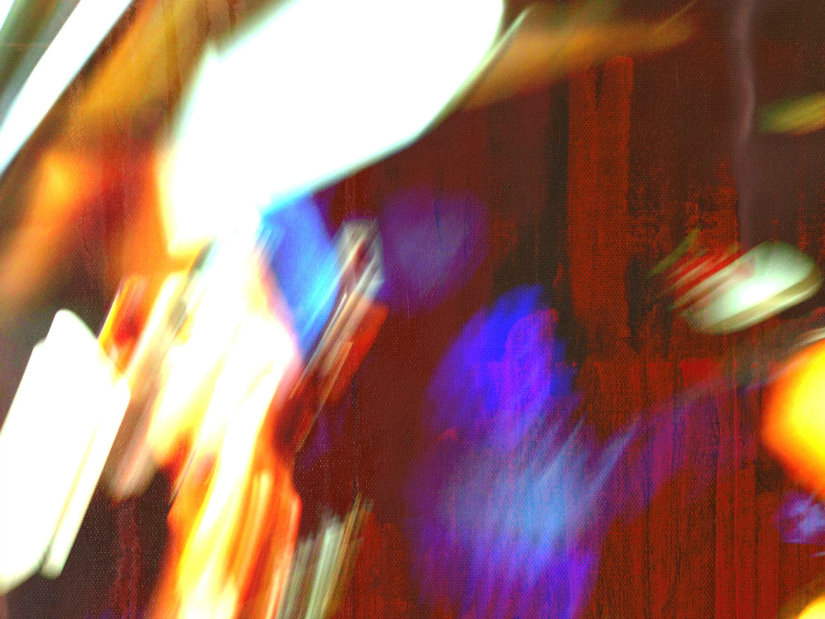
Image resolution: width=825 pixels, height=619 pixels. I want to click on wall, so click(x=657, y=108).